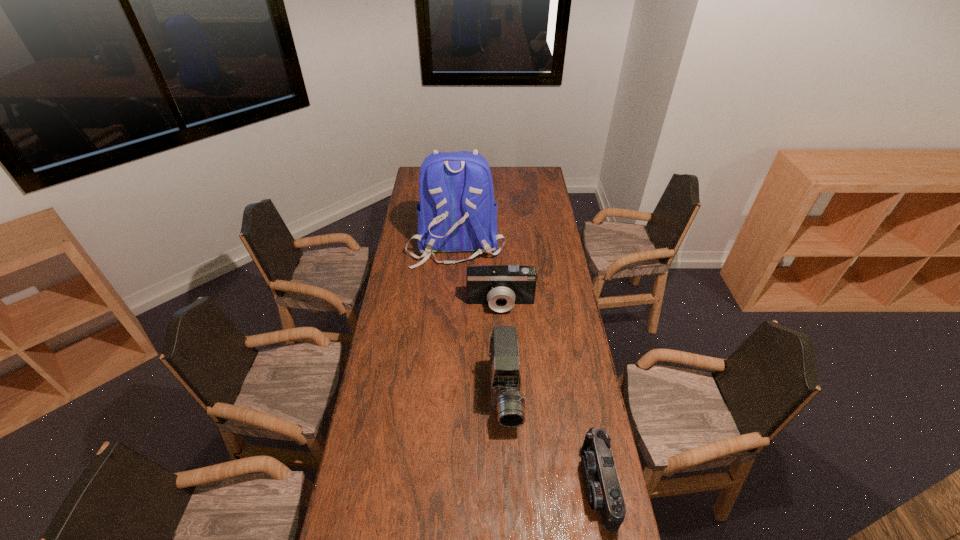
The width and height of the screenshot is (960, 540). I want to click on vacant area between the backpack and the third shortest object, so click(481, 320).

This screenshot has width=960, height=540. Find the location of `free space between the rightmost camcorder and the tallest object`. free space between the rightmost camcorder and the tallest object is located at coordinates (527, 363).

Find the location of a particular element. The height and width of the screenshot is (540, 960). empty space that is in between the farthest camcorder and the shortest camcorder is located at coordinates (549, 394).

Point out which object is positioned as the second nearest to the third nearest object. Please provide its 2D coordinates. Your answer should be formatted as a tuple, i.e. [(x, y)], where the tuple contains the x and y coordinates of a point satisfying the conditions above.

[(506, 399)]

This screenshot has height=540, width=960. I want to click on object that is the closest one to the shortest camcorder, so click(506, 399).

At what (x,y) coordinates should I click in order to perform the action: click on camcorder that is the closest one to the third tallest object. Please return your answer as a coordinate pair (x, y). Image resolution: width=960 pixels, height=540 pixels. Looking at the image, I should click on (506, 399).

Identify the location of camcorder that is the second closest to the third nearest object. [603, 490].